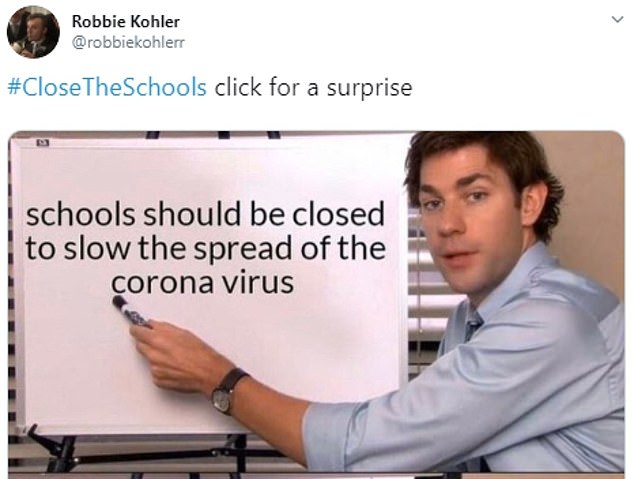
Locate an element on the screen. The width and height of the screenshot is (634, 479). dry erase marker is located at coordinates (129, 311).